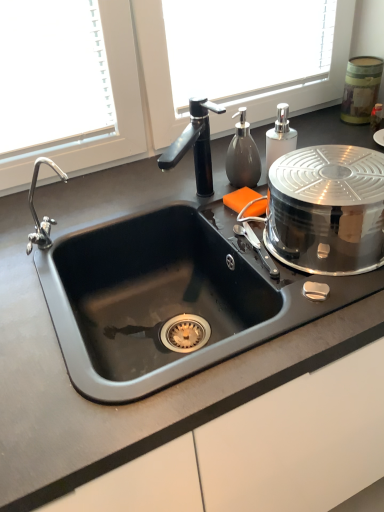
What do you see at coordinates (280, 136) in the screenshot? I see `white glossy soap dispenser at upper right, positioned as the second soap dispenser in left-to-right order` at bounding box center [280, 136].

What is the approximate width of matte gray soap dispenser at upper right, the second soap dispenser from the right?

matte gray soap dispenser at upper right, the second soap dispenser from the right, is 2.06 inches wide.

You are a GUI agent. You are given a task and a screenshot of the screen. Output one action in this format:
    pyautogui.click(x=<x>, y=<y>)
    Task: Click on the polished stainless steel lid at right, which is the 1th appliance from left to right
    This screenshot has height=512, width=384.
    Given the screenshot: What is the action you would take?
    pyautogui.click(x=327, y=209)

Considering the positions of objects white glossy soap dispenser at upper right, arranged as the first soap dispenser when viewed from the right, and polished stainless steel lid at right, which is the first appliance in bottom-to-top order, in the image provided, who is more to the right, white glossy soap dispenser at upper right, arranged as the first soap dispenser when viewed from the right, or polished stainless steel lid at right, which is the first appliance in bottom-to-top order,?

From the viewer's perspective, polished stainless steel lid at right, which is the first appliance in bottom-to-top order, appears more on the right side.

Is white glossy soap dispenser at upper right, arranged as the first soap dispenser when viewed from the right, bigger than polished stainless steel lid at right, which is the 1th appliance from left to right?

No.

Can you tell me how much white glossy soap dispenser at upper right, arranged as the first soap dispenser when viewed from the right, and polished stainless steel lid at right, marked as the second appliance in a right-to-left arrangement, differ in facing direction?

The angle between the facing direction of white glossy soap dispenser at upper right, arranged as the first soap dispenser when viewed from the right, and the facing direction of polished stainless steel lid at right, marked as the second appliance in a right-to-left arrangement, is 2.27 degrees.

From a real-world perspective, is matte gray soap dispenser at upper right, the second soap dispenser from the right, positioned above or below metallic canister at upper right, which is counted as the first appliance, starting from the top?

matte gray soap dispenser at upper right, the second soap dispenser from the right, is situated higher than metallic canister at upper right, which is counted as the first appliance, starting from the top, in the real world.

Is matte gray soap dispenser at upper right, the second soap dispenser from the right, spatially inside metallic canister at upper right, placed as the 1th appliance when sorted from back to front, or outside of it?

The correct answer is: outside.

Would you say matte gray soap dispenser at upper right, which appears as the first soap dispenser when viewed from the left, is a long distance from metallic canister at upper right, placed as the second appliance when sorted from bottom to top?

matte gray soap dispenser at upper right, which appears as the first soap dispenser when viewed from the left, is actually quite close to metallic canister at upper right, placed as the second appliance when sorted from bottom to top.

Considering the relative sizes of metallic canister at upper right, which is counted as the first appliance, starting from the top, and polished stainless steel lid at right, which ranks as the 1th appliance in front-to-back order, in the image provided, is metallic canister at upper right, which is counted as the first appliance, starting from the top, taller than polished stainless steel lid at right, which ranks as the 1th appliance in front-to-back order,?

Indeed, metallic canister at upper right, which is counted as the first appliance, starting from the top, has a greater height compared to polished stainless steel lid at right, which ranks as the 1th appliance in front-to-back order.

From a real-world perspective, is metallic canister at upper right, which is the 2th appliance in front-to-back order, positioned above or below polished stainless steel lid at right, marked as the 2th appliance in a back-to-front arrangement?

metallic canister at upper right, which is the 2th appliance in front-to-back order, is situated higher than polished stainless steel lid at right, marked as the 2th appliance in a back-to-front arrangement, in the real world.

From the image's perspective, is metallic canister at upper right, placed as the second appliance when sorted from bottom to top, below polished stainless steel lid at right, marked as the 2th appliance in a back-to-front arrangement?

No, from the image's perspective, metallic canister at upper right, placed as the second appliance when sorted from bottom to top, is not below polished stainless steel lid at right, marked as the 2th appliance in a back-to-front arrangement.

Which is behind, metallic canister at upper right, which is counted as the first appliance, starting from the top, or polished stainless steel lid at right, which is the 1th appliance from left to right?

Positioned behind is metallic canister at upper right, which is counted as the first appliance, starting from the top.

Visually, is polished stainless steel lid at right, marked as the 2th appliance in a back-to-front arrangement, positioned to the left or to the right of metallic canister at upper right, which is the 2th appliance in front-to-back order?

Based on their positions, polished stainless steel lid at right, marked as the 2th appliance in a back-to-front arrangement, is located to the left of metallic canister at upper right, which is the 2th appliance in front-to-back order.

How different are the orientations of polished stainless steel lid at right, which is the first appliance in bottom-to-top order, and metallic canister at upper right, which is counted as the first appliance, starting from the top, in degrees?

The angular difference between polished stainless steel lid at right, which is the first appliance in bottom-to-top order, and metallic canister at upper right, which is counted as the first appliance, starting from the top, is 2.1 degrees.

From the image's perspective, would you say polished stainless steel lid at right, which is the first appliance in bottom-to-top order, is positioned over metallic canister at upper right, placed as the second appliance when sorted from bottom to top?

No, from the image's perspective, polished stainless steel lid at right, which is the first appliance in bottom-to-top order, is not over metallic canister at upper right, placed as the second appliance when sorted from bottom to top.

Is metallic canister at upper right, placed as the 1th appliance when sorted from back to front, a part of polished stainless steel lid at right, the second appliance from the top?

Definitely not — metallic canister at upper right, placed as the 1th appliance when sorted from back to front, is not inside polished stainless steel lid at right, the second appliance from the top.

Which of these two, white glossy soap dispenser at upper right, positioned as the second soap dispenser in left-to-right order, or matte gray soap dispenser at upper right, the second soap dispenser from the right, is wider?

white glossy soap dispenser at upper right, positioned as the second soap dispenser in left-to-right order.

Measure the distance from white glossy soap dispenser at upper right, arranged as the first soap dispenser when viewed from the right, to matte gray soap dispenser at upper right, the second soap dispenser from the right.

white glossy soap dispenser at upper right, arranged as the first soap dispenser when viewed from the right, and matte gray soap dispenser at upper right, the second soap dispenser from the right, are 2.51 inches apart from each other.

From a real-world perspective, which object rests below the other?

white glossy soap dispenser at upper right, positioned as the second soap dispenser in left-to-right order.

From the image's perspective, is white glossy soap dispenser at upper right, arranged as the first soap dispenser when viewed from the right, below matte gray soap dispenser at upper right, which appears as the first soap dispenser when viewed from the left?

Actually, white glossy soap dispenser at upper right, arranged as the first soap dispenser when viewed from the right, appears above matte gray soap dispenser at upper right, which appears as the first soap dispenser when viewed from the left, in the image.

In terms of height, does polished stainless steel lid at right, which is the 1th appliance from left to right, look taller or shorter compared to matte gray soap dispenser at upper right, the second soap dispenser from the right?

polished stainless steel lid at right, which is the 1th appliance from left to right, is taller than matte gray soap dispenser at upper right, the second soap dispenser from the right.

How different are the orientations of polished stainless steel lid at right, marked as the 2th appliance in a back-to-front arrangement, and matte gray soap dispenser at upper right, the second soap dispenser from the right, in degrees?

There is a 2.27-degree angle between the facing directions of polished stainless steel lid at right, marked as the 2th appliance in a back-to-front arrangement, and matte gray soap dispenser at upper right, the second soap dispenser from the right.

From the image's perspective, who appears lower, polished stainless steel lid at right, which is the 1th appliance from left to right, or matte gray soap dispenser at upper right, which appears as the first soap dispenser when viewed from the left?

polished stainless steel lid at right, which is the 1th appliance from left to right, is shown below in the image.

The height and width of the screenshot is (512, 384). Identify the location of appliance that appears in front of the matte gray soap dispenser at upper right, the second soap dispenser from the right. (327, 209).

Is polished stainless steel lid at right, the second appliance from the top, touching white glossy soap dispenser at upper right, arranged as the first soap dispenser when viewed from the right?

There is a gap between polished stainless steel lid at right, the second appliance from the top, and white glossy soap dispenser at upper right, arranged as the first soap dispenser when viewed from the right.

From a real-world perspective, is polished stainless steel lid at right, marked as the second appliance in a right-to-left arrangement, physically located above or below white glossy soap dispenser at upper right, arranged as the first soap dispenser when viewed from the right?

polished stainless steel lid at right, marked as the second appliance in a right-to-left arrangement, is below white glossy soap dispenser at upper right, arranged as the first soap dispenser when viewed from the right.

Between polished stainless steel lid at right, marked as the 2th appliance in a back-to-front arrangement, and white glossy soap dispenser at upper right, positioned as the second soap dispenser in left-to-right order, which one is positioned in front?

polished stainless steel lid at right, marked as the 2th appliance in a back-to-front arrangement.

Is polished stainless steel lid at right, marked as the second appliance in a right-to-left arrangement, to the left of white glossy soap dispenser at upper right, positioned as the second soap dispenser in left-to-right order, from the viewer's perspective?

Incorrect, polished stainless steel lid at right, marked as the second appliance in a right-to-left arrangement, is not on the left side of white glossy soap dispenser at upper right, positioned as the second soap dispenser in left-to-right order.

Find the location of a particular element. This screenshot has width=384, height=512. soap dispenser that is the 1st object above the polished stainless steel lid at right, which is the 1th appliance from left to right (from a real-world perspective) is located at coordinates (280, 136).

At what (x,y) coordinates should I click in order to perform the action: click on appliance that is behind the matte gray soap dispenser at upper right, which appears as the first soap dispenser when viewed from the left. Please return your answer as a coordinate pair (x, y). Looking at the image, I should click on (361, 88).

When comparing their distances from metallic canister at upper right, the first appliance positioned from the right, does polished stainless steel lid at right, which is the first appliance in bottom-to-top order, or white glossy soap dispenser at upper right, arranged as the first soap dispenser when viewed from the right, seem further?

polished stainless steel lid at right, which is the first appliance in bottom-to-top order, lies further to metallic canister at upper right, the first appliance positioned from the right, than the other object.

From the image, which object appears to be nearer to metallic canister at upper right, placed as the 1th appliance when sorted from back to front, white glossy soap dispenser at upper right, arranged as the first soap dispenser when viewed from the right, or matte gray soap dispenser at upper right, which appears as the first soap dispenser when viewed from the left?

white glossy soap dispenser at upper right, arranged as the first soap dispenser when viewed from the right, is closer to metallic canister at upper right, placed as the 1th appliance when sorted from back to front.

When comparing their distances from polished stainless steel lid at right, which is the 1th appliance from left to right, does matte gray soap dispenser at upper right, the second soap dispenser from the right, or white glossy soap dispenser at upper right, positioned as the second soap dispenser in left-to-right order, seem closer?

Among the two, white glossy soap dispenser at upper right, positioned as the second soap dispenser in left-to-right order, is located nearer to polished stainless steel lid at right, which is the 1th appliance from left to right.

Estimate the real-world distances between objects in this image. Which object is further from metallic canister at upper right, the first appliance positioned from the right, polished stainless steel lid at right, marked as the 2th appliance in a back-to-front arrangement, or matte gray soap dispenser at upper right, which appears as the first soap dispenser when viewed from the left?

polished stainless steel lid at right, marked as the 2th appliance in a back-to-front arrangement, is positioned further to the anchor metallic canister at upper right, the first appliance positioned from the right.

Looking at this image, when comparing their distances from polished stainless steel lid at right, which is the 1th appliance from left to right, does metallic canister at upper right, which is the 2th appliance in front-to-back order, or white glossy soap dispenser at upper right, positioned as the second soap dispenser in left-to-right order, seem further?

The object further to polished stainless steel lid at right, which is the 1th appliance from left to right, is metallic canister at upper right, which is the 2th appliance in front-to-back order.

Which object lies nearer to the anchor point white glossy soap dispenser at upper right, positioned as the second soap dispenser in left-to-right order, matte gray soap dispenser at upper right, the second soap dispenser from the right, or metallic canister at upper right, placed as the second appliance when sorted from bottom to top?

Based on the image, matte gray soap dispenser at upper right, the second soap dispenser from the right, appears to be nearer to white glossy soap dispenser at upper right, positioned as the second soap dispenser in left-to-right order.

When comparing their distances from polished stainless steel lid at right, which ranks as the 1th appliance in front-to-back order, does metallic canister at upper right, which is the 2th appliance in front-to-back order, or matte gray soap dispenser at upper right, which appears as the first soap dispenser when viewed from the left, seem further?

metallic canister at upper right, which is the 2th appliance in front-to-back order.

Looking at the image, which one is located closer to white glossy soap dispenser at upper right, arranged as the first soap dispenser when viewed from the right, metallic canister at upper right, which is the 2th appliance in front-to-back order, or matte gray soap dispenser at upper right, the second soap dispenser from the right?

matte gray soap dispenser at upper right, the second soap dispenser from the right, is closer to white glossy soap dispenser at upper right, arranged as the first soap dispenser when viewed from the right.

Identify the location of soap dispenser located between matte gray soap dispenser at upper right, the second soap dispenser from the right, and metallic canister at upper right, which is the 2th appliance in front-to-back order, in the left-right direction. (280, 136).

Where is `soap dispenser positioned between polished stainless steel lid at right, the second appliance from the top, and white glossy soap dispenser at upper right, positioned as the second soap dispenser in left-to-right order, from near to far`? The width and height of the screenshot is (384, 512). soap dispenser positioned between polished stainless steel lid at right, the second appliance from the top, and white glossy soap dispenser at upper right, positioned as the second soap dispenser in left-to-right order, from near to far is located at coordinates (243, 155).